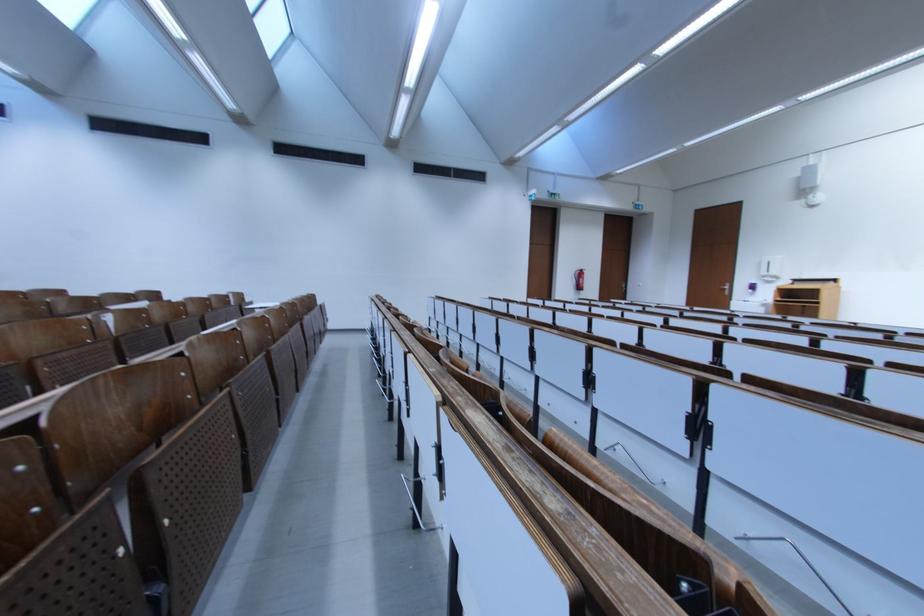
The height and width of the screenshot is (616, 924). What do you see at coordinates (578, 278) in the screenshot?
I see `the fire extinguisher handle` at bounding box center [578, 278].